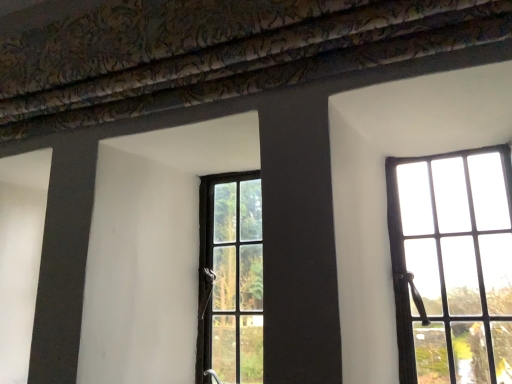
Question: Do you think matte black window at right, positioned as the second window in left-to-right order, is within matte black window at center, the 2th window in the right-to-left sequence, or outside of it?

Choices:
 (A) inside
 (B) outside

Answer: (B)

Question: Is point (456, 362) closer or farther from the camera than point (225, 283)?

Choices:
 (A) farther
 (B) closer

Answer: (B)

Question: From a real-world perspective, is matte black window at right, positioned as the second window in left-to-right order, above or below matte black window at center, the first window positioned from the left?

Choices:
 (A) above
 (B) below

Answer: (A)

Question: Considering the relative positions of matte black window at center, the first window positioned from the left, and matte black window at right, positioned as the second window in left-to-right order, in the image provided, is matte black window at center, the first window positioned from the left, to the left or to the right of matte black window at right, positioned as the second window in left-to-right order,?

Choices:
 (A) left
 (B) right

Answer: (A)

Question: From the image's perspective, is matte black window at center, the 2th window in the right-to-left sequence, positioned above or below matte black window at right, positioned as the second window in left-to-right order?

Choices:
 (A) below
 (B) above

Answer: (A)

Question: Based on their sizes in the image, would you say matte black window at center, the 2th window in the right-to-left sequence, is bigger or smaller than matte black window at right, positioned as the second window in left-to-right order?

Choices:
 (A) small
 (B) big

Answer: (A)

Question: From a real-world perspective, relative to matte black window at right, placed as the first window when sorted from right to left, is matte black window at center, the first window positioned from the left, vertically above or below?

Choices:
 (A) below
 (B) above

Answer: (A)